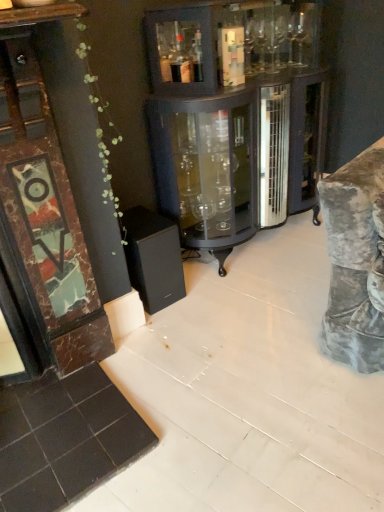
The image size is (384, 512). Describe the element at coordinates (153, 258) in the screenshot. I see `black matte speaker at lower left` at that location.

Where is `black matte speaker at lower left`? This screenshot has height=512, width=384. black matte speaker at lower left is located at coordinates pyautogui.click(x=153, y=258).

You are a GUI agent. You are given a task and a screenshot of the screen. Output one action in this format:
    pyautogui.click(x=<x>, y=<y>)
    Task: Click on the black matte speaker at lower left
    The width and height of the screenshot is (384, 512).
    Given the screenshot: What is the action you would take?
    pyautogui.click(x=153, y=258)